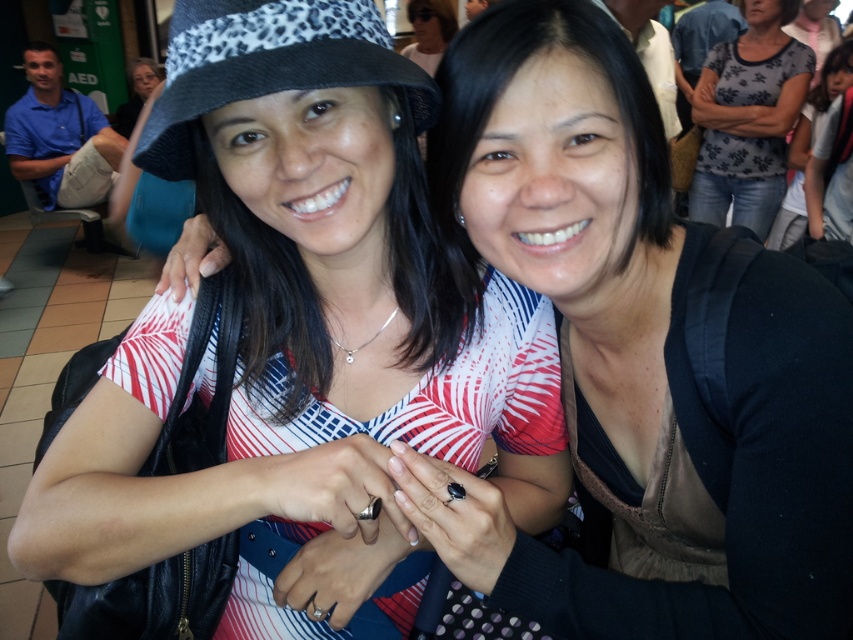
Question: Can you confirm if white matte hat at upper left is positioned below black leopard print hat at upper left?

Choices:
 (A) no
 (B) yes

Answer: (B)

Question: Can you confirm if white matte hat at upper left is positioned above black leopard print hat at upper left?

Choices:
 (A) yes
 (B) no

Answer: (B)

Question: Which of the following is the closest to the observer?

Choices:
 (A) (740, 109)
 (B) (347, 176)

Answer: (B)

Question: Which of the following is the closest to the observer?

Choices:
 (A) (421, 275)
 (B) (192, 100)
 (C) (798, 42)

Answer: (B)

Question: Which object is closer to the camera taking this photo?

Choices:
 (A) black leopard print hat at upper left
 (B) white matte hat at upper left

Answer: (A)

Question: Considering the relative positions of black leopard print hat at upper left and floral-patterned shirt at upper right in the image provided, where is black leopard print hat at upper left located with respect to floral-patterned shirt at upper right?

Choices:
 (A) below
 (B) above

Answer: (A)